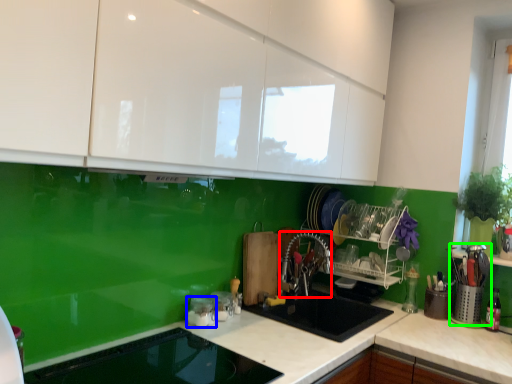
Question: Estimate the real-world distances between objects in this image. Which object is farther from silverware (highlighted by a red box), appliance (highlighted by a blue box) or appliance (highlighted by a green box)?

Choices:
 (A) appliance
 (B) appliance

Answer: (B)